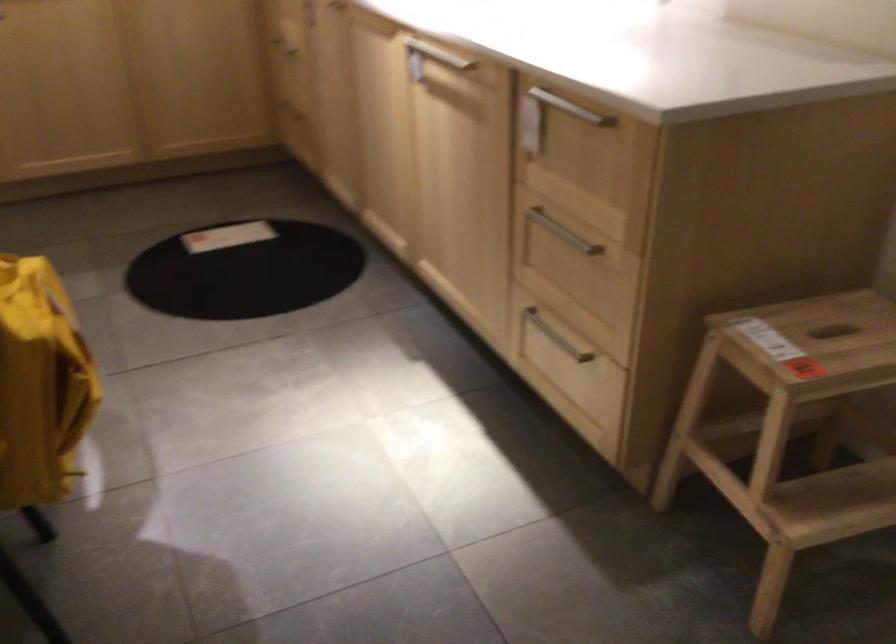
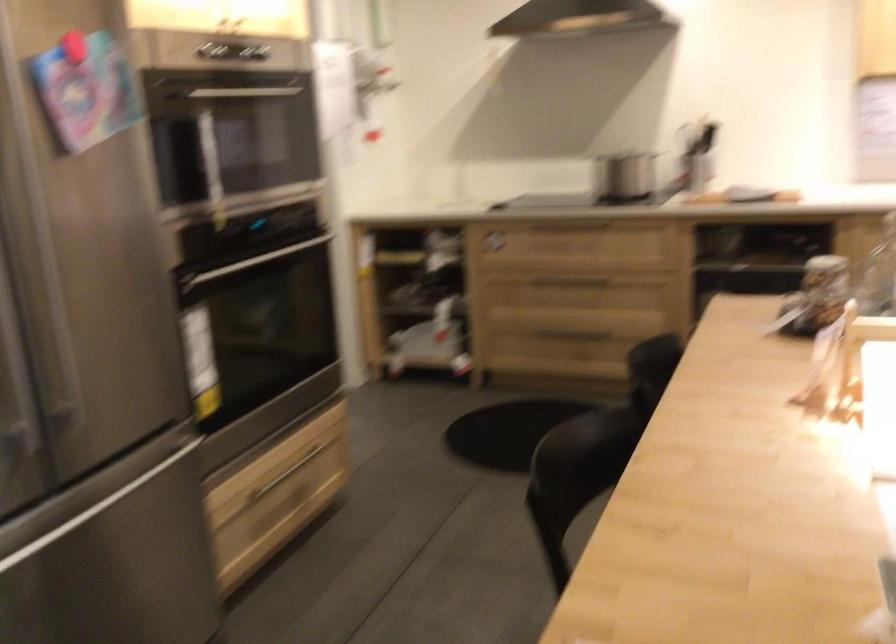
Question: The camera is either moving clockwise (left) or counter-clockwise (right) around the object. The first image is from the beginning of the video and the second image is from the end. Is the camera moving left or right when shooting the video?

Choices:
 (A) Left
 (B) Right

Answer: (B)